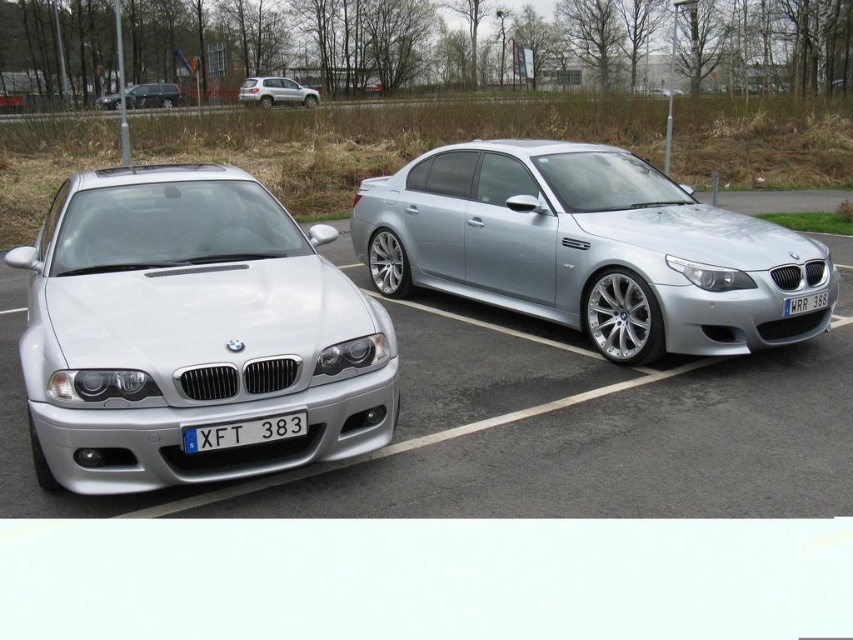
Question: Based on their relative distances, which object is farther from the silver metallic suv at upper left?

Choices:
 (A) satin silver sedan at left
 (B) blue metallic license plate at lower center
 (C) satin black suv at upper left
 (D) white plastic license plate at center

Answer: (B)

Question: Which of the following is the closest to the observer?

Choices:
 (A) silver metallic suv at upper left
 (B) satin black suv at upper left
 (C) blue metallic license plate at lower center

Answer: (C)

Question: Which object appears farthest from the camera in this image?

Choices:
 (A) satin black suv at upper left
 (B) silver metallic car at left

Answer: (A)

Question: Is satin silver sedan at center positioned behind white plastic license plate at center?

Choices:
 (A) yes
 (B) no

Answer: (B)

Question: Can you confirm if satin silver sedan at left is wider than satin black suv at upper left?

Choices:
 (A) no
 (B) yes

Answer: (A)

Question: In this image, where is satin silver sedan at center located relative to silver metallic suv at upper left?

Choices:
 (A) left
 (B) right

Answer: (B)